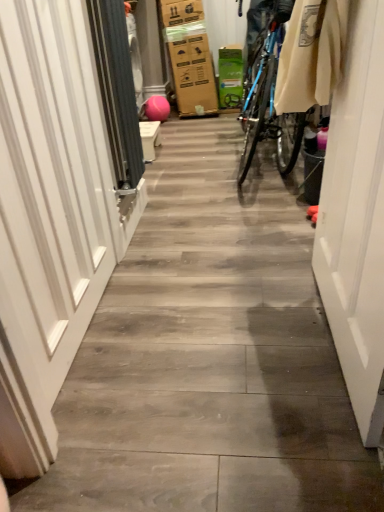
Question: Is gray fabric screen door at left to the left of white glossy door at left from the viewer's perspective?

Choices:
 (A) yes
 (B) no

Answer: (B)

Question: From the image's perspective, is gray fabric screen door at left on top of white glossy door at left?

Choices:
 (A) yes
 (B) no

Answer: (A)

Question: Does gray fabric screen door at left lie behind white glossy door at left?

Choices:
 (A) no
 (B) yes

Answer: (B)

Question: Would you say gray fabric screen door at left is a long distance from white glossy door at left?

Choices:
 (A) yes
 (B) no

Answer: (B)

Question: Is gray fabric screen door at left positioned before white glossy door at left?

Choices:
 (A) no
 (B) yes

Answer: (A)

Question: From the image's perspective, is gray fabric screen door at left located beneath white glossy door at left?

Choices:
 (A) yes
 (B) no

Answer: (B)

Question: Is white glossy door at left at the left side of gray fabric screen door at left?

Choices:
 (A) yes
 (B) no

Answer: (A)

Question: Is white glossy door at left beside gray fabric screen door at left?

Choices:
 (A) no
 (B) yes

Answer: (A)

Question: Can you confirm if white glossy door at left is bigger than gray fabric screen door at left?

Choices:
 (A) yes
 (B) no

Answer: (A)

Question: Is white glossy door at left positioned behind gray fabric screen door at left?

Choices:
 (A) no
 (B) yes

Answer: (A)

Question: From a real-world perspective, is white glossy door at left located beneath gray fabric screen door at left?

Choices:
 (A) yes
 (B) no

Answer: (A)

Question: Could you tell me if white glossy door at left is turned towards gray fabric screen door at left?

Choices:
 (A) yes
 (B) no

Answer: (B)

Question: From the image's perspective, is white glossy door at right under white glossy door at left?

Choices:
 (A) no
 (B) yes

Answer: (B)